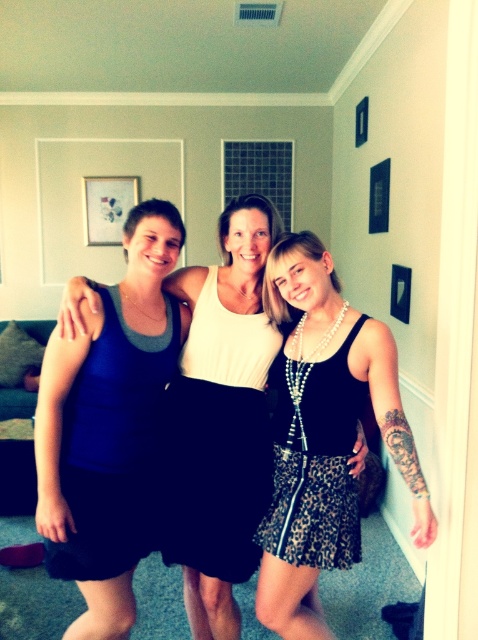
Question: Can you confirm if white matte dress at center is wider than leopard print skirt at center?

Choices:
 (A) yes
 (B) no

Answer: (A)

Question: Is black satin dress at right bigger than white matte dress at center?

Choices:
 (A) no
 (B) yes

Answer: (B)

Question: Which of the following is the closest to the observer?

Choices:
 (A) (239, 500)
 (B) (105, 534)
 (C) (279, 490)
 (D) (336, 490)

Answer: (B)

Question: Does matte blue tank top at left have a lesser width compared to leopard print skirt at center?

Choices:
 (A) no
 (B) yes

Answer: (A)

Question: Which point appears closest to the camera in this image?

Choices:
 (A) (253, 381)
 (B) (293, 630)
 (C) (294, 563)
 (D) (112, 502)

Answer: (C)

Question: Which is nearer to the white matte dress at center?

Choices:
 (A) black satin dress at right
 (B) matte blue tank top at left

Answer: (B)